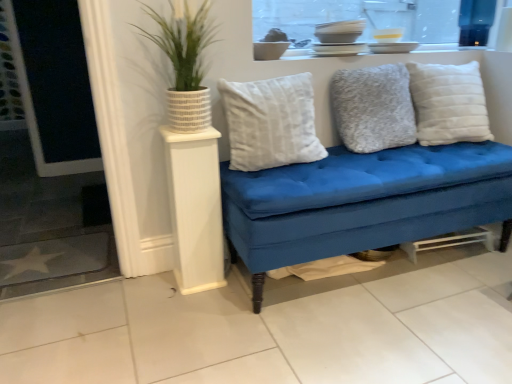
Question: Does point tap(386, 109) appear closer or farther from the camera than point tap(197, 188)?

Choices:
 (A) closer
 (B) farther

Answer: (B)

Question: From their relative heights in the image, would you say fuzzy gray pillow at center, marked as the second pillow in a left-to-right arrangement, is taller or shorter than white wood side table at left?

Choices:
 (A) tall
 (B) short

Answer: (B)

Question: Considering the real-world distances, which object is farthest from the white textured pillow at right, which is the third pillow in left-to-right order?

Choices:
 (A) white plush pillow at center, the first pillow in the left-to-right sequence
 (B) fuzzy gray pillow at center, which is the second pillow from right to left
 (C) white wood side table at left
 (D) green textured plant at upper left

Answer: (C)

Question: Which is farther from the white wood side table at left?

Choices:
 (A) white textured pillow at right, which is the third pillow in left-to-right order
 (B) fuzzy gray pillow at center, which is the second pillow from right to left
 (C) white plush pillow at center, placed as the 3th pillow when sorted from right to left
 (D) green textured plant at upper left

Answer: (A)